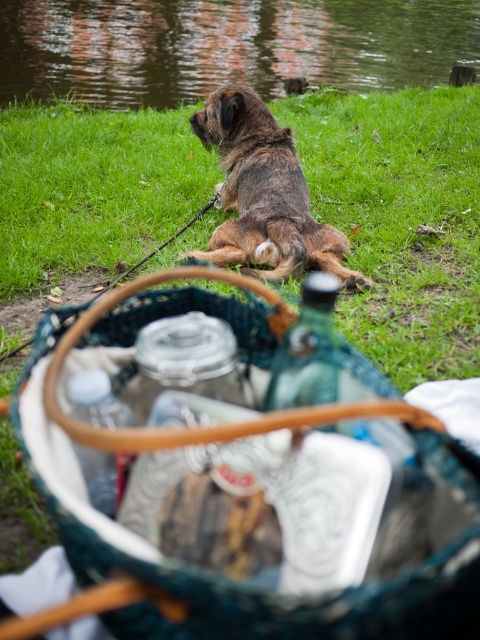
Question: Which object appears farthest from the camera in this image?

Choices:
 (A) green water at upper center
 (B) brown shaggy dog at center

Answer: (A)

Question: Among these objects, which one is nearest to the camera?

Choices:
 (A) green water at upper center
 (B) brown shaggy dog at center

Answer: (B)

Question: Does green water at upper center lie behind brown shaggy dog at center?

Choices:
 (A) no
 (B) yes

Answer: (B)

Question: Can you confirm if green water at upper center is thinner than brown shaggy dog at center?

Choices:
 (A) yes
 (B) no

Answer: (B)

Question: From the image, what is the correct spatial relationship of green water at upper center in relation to brown shaggy dog at center?

Choices:
 (A) below
 (B) above

Answer: (B)